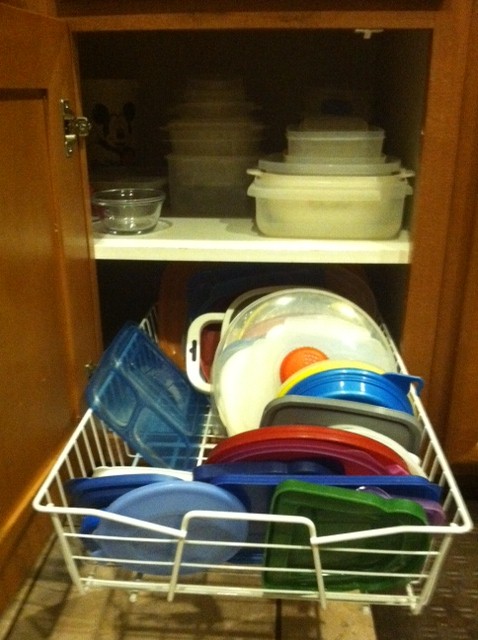
Where is `hook`? The height and width of the screenshot is (640, 478). hook is located at coordinates (366, 41).